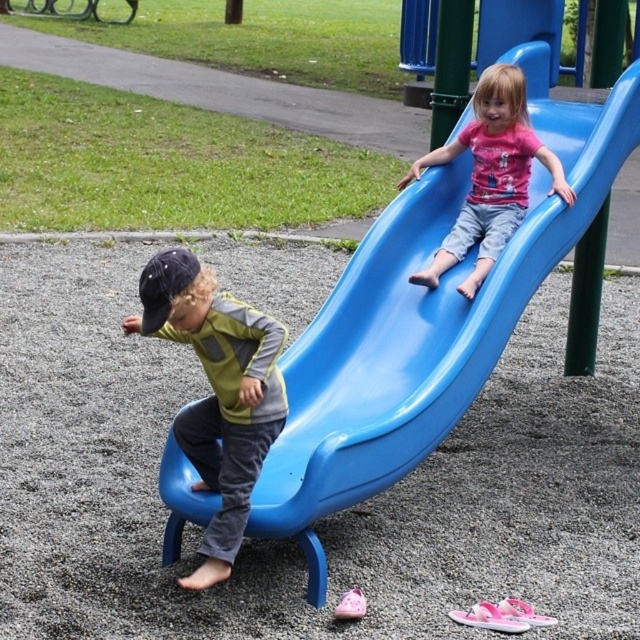
Question: Which point is closer to the camera taking this photo?

Choices:
 (A) (221, 548)
 (B) (305, 529)
 (C) (492, 259)

Answer: (A)

Question: Which object is positioned closest to the glossy plastic slide at upper right?

Choices:
 (A) matte pink shirt at upper center
 (B) matte green vest at center

Answer: (A)

Question: Does glossy plastic slide at upper right appear on the right side of matte green vest at center?

Choices:
 (A) yes
 (B) no

Answer: (A)

Question: Is matte green vest at center thinner than matte pink shirt at upper center?

Choices:
 (A) yes
 (B) no

Answer: (A)

Question: Among these points, which one is farthest from the camera?

Choices:
 (A) (202, 586)
 (B) (397, 269)

Answer: (B)

Question: Is glossy plastic slide at upper right bigger than matte pink shirt at upper center?

Choices:
 (A) yes
 (B) no

Answer: (A)